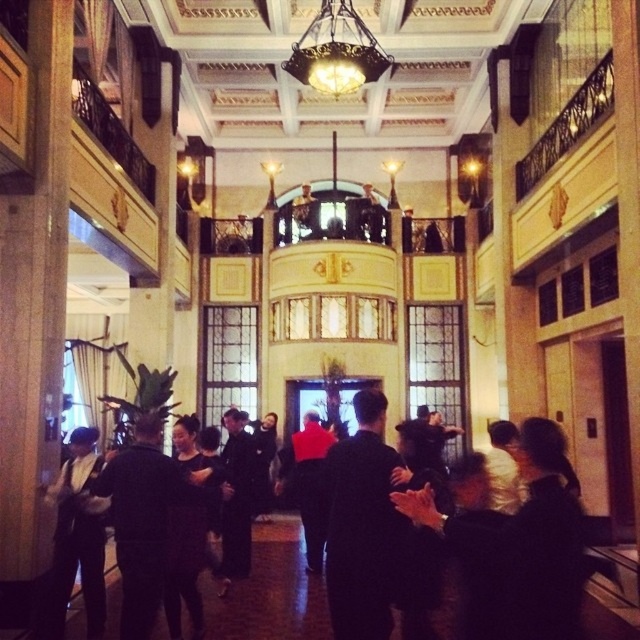
You are a fashion designer attending an event in this grand building and see both the black matte dress at center and the red fabric jacket at center. Which clothing item is positioned more to the left side of the room?

The black matte dress at center is positioned to the left of the red fabric jacket at center, so it is more to the left side of the room.

You are a fashion designer attending an event in this grand building and notice a black matte dress at center. If you want to place a mannequin that is 1.8 meters tall next to it, will there be enough space between them?

The black matte dress at center and the mannequin are 30.59 meters apart, so there is ample space to place the mannequin next to it.

You are a fashion designer observing a runway show in this grand venue. You notice two garments at the center of the stage. Which one is shorter in height between the black matte dress at center and the black fabric coat at center?

The black matte dress at center is shorter in height compared to the black fabric coat at center.